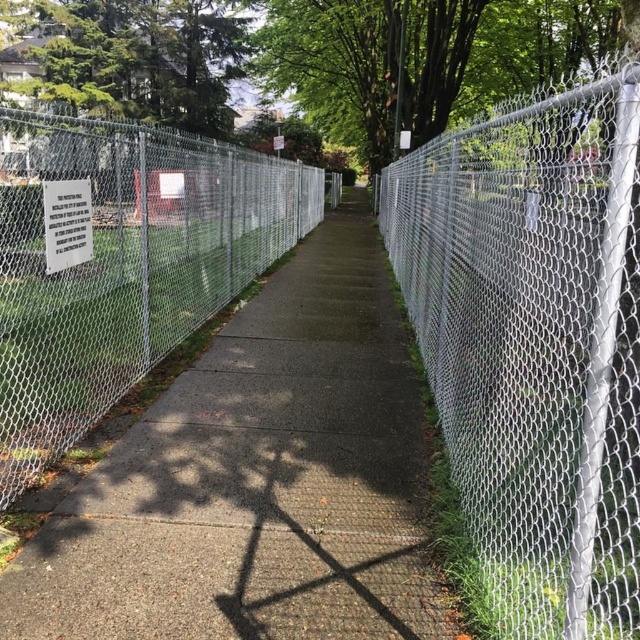
You are standing at the point with coordinates (534, 344) on the sidewalk. What object is located exactly at that point?

The silver chainlink fence at right is located exactly at point (534, 344).